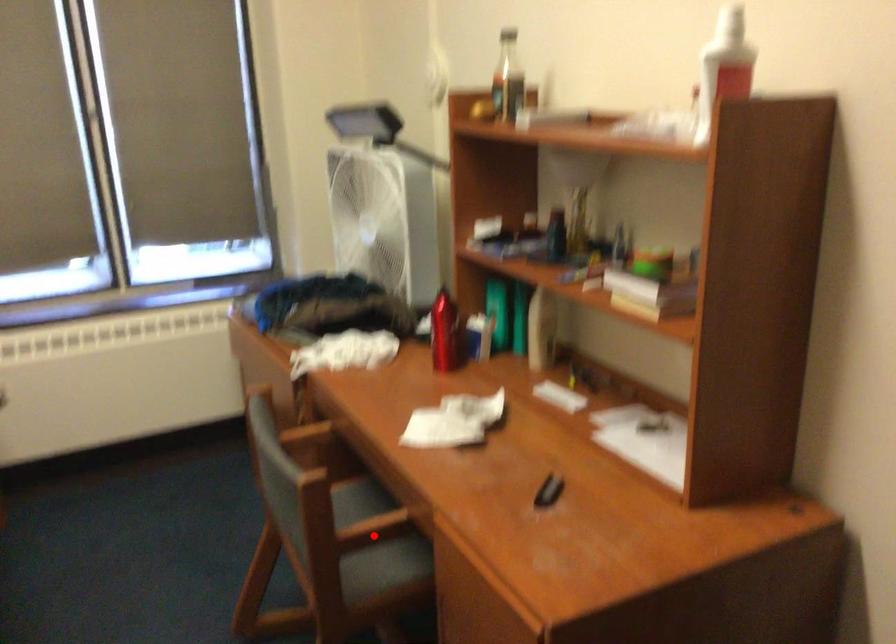
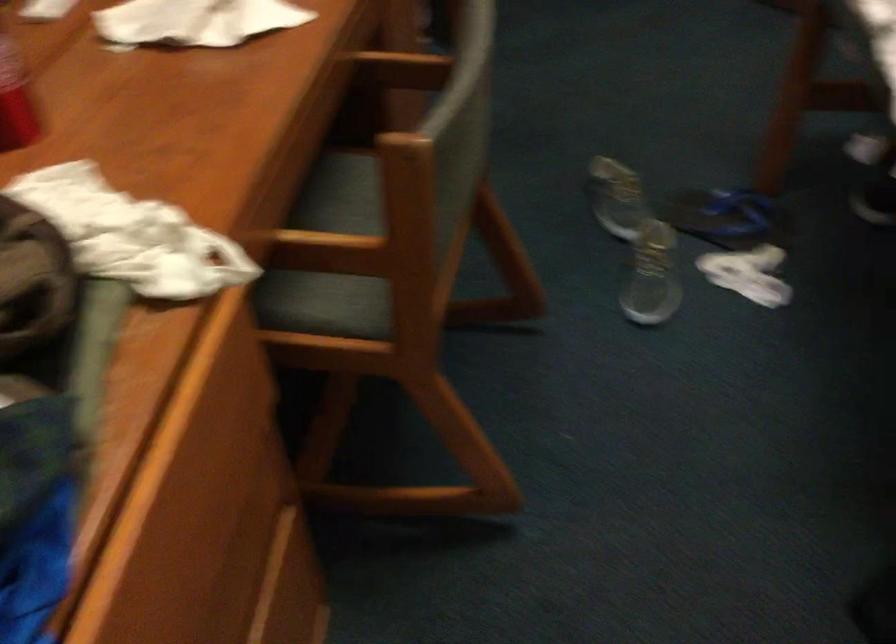
Question: I am providing you with two images of the same scene from different viewpoints. A red point is marked on the first image. Is the red point's position out of view in image 2?

Choices:
 (A) Yes
 (B) No

Answer: (B)